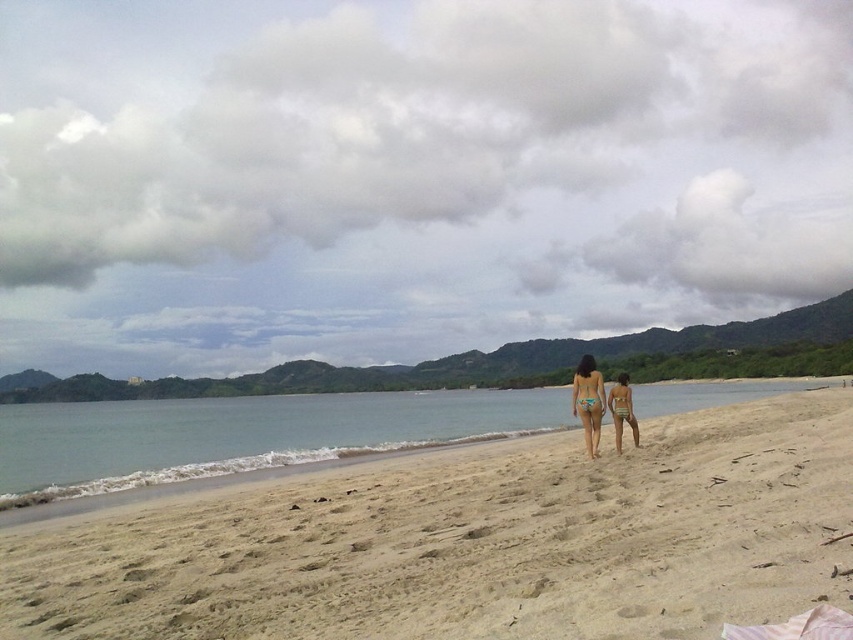
You are standing at the origin point of the coordinate system. You want to walk to the light beige sand at center. Which direction should you move in?

The light beige sand at center is located at coordinate point 0.847 in the x direction and 0.555 in the y direction. Since you are at the origin, you should move towards the positive x and positive y directions to reach it.